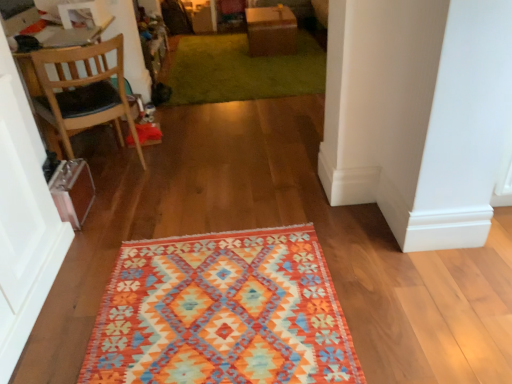
This screenshot has height=384, width=512. I want to click on free point above textured woolen rug at center (from a real-world perspective), so click(x=213, y=296).